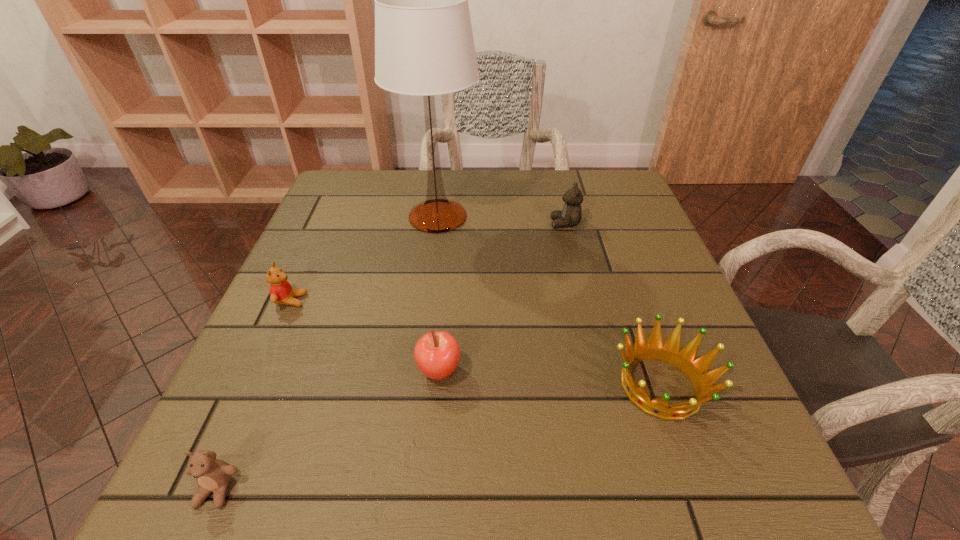
Where is `free spot that satisfies the following two spatial constraints: 1. above the cylindrical shade of the apple; 2. on the right side of the tallest object`? The width and height of the screenshot is (960, 540). free spot that satisfies the following two spatial constraints: 1. above the cylindrical shade of the apple; 2. on the right side of the tallest object is located at coordinates (x=419, y=371).

This screenshot has height=540, width=960. I want to click on free location that satisfies the following two spatial constraints: 1. above the cylindrical shade of the table lamp; 2. on the front-facing side of the nearest teddy bear, so click(x=403, y=490).

This screenshot has height=540, width=960. What are the coordinates of `blank space that satisfies the following two spatial constraints: 1. on the face of the tallest teddy bear; 2. on the front-facing side of the nearest object` in the screenshot? It's located at (630, 490).

Locate an element on the screen. The image size is (960, 540). free space in the image that satisfies the following two spatial constraints: 1. on the face of the rightmost teddy bear; 2. on the back side of the crown is located at coordinates (605, 386).